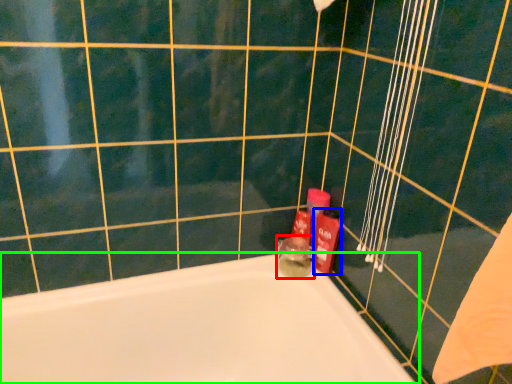
Question: Considering the real-world distances, which object is closest to toiletry (highlighted by a red box)? toiletry (highlighted by a blue box) or bathtub (highlighted by a green box).

Choices:
 (A) toiletry
 (B) bathtub

Answer: (A)